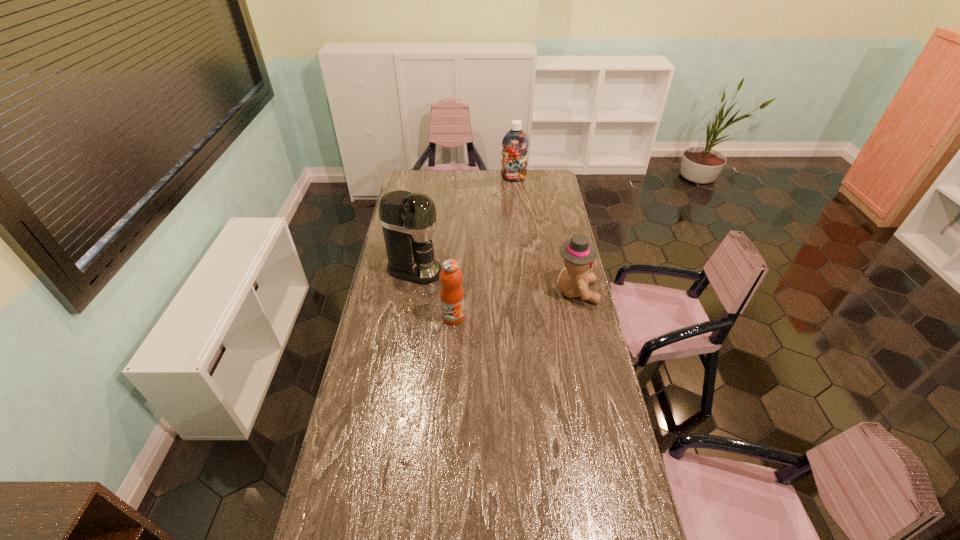
Image resolution: width=960 pixels, height=540 pixels. In order to click on free spot on the desktop that is between the third object from right to left and the rightmost object and is positioned on the front label of the shampoo in this screenshot , I will do `click(500, 307)`.

In order to click on free spot on the desktop that is between the third object from right to left and the rag_doll and is positioned place cup under the spout of the leftmost object in this screenshot , I will do `click(531, 301)`.